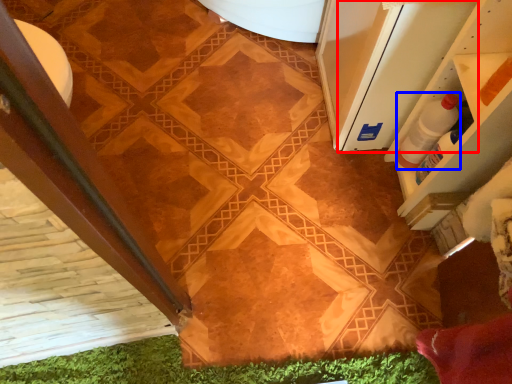
Question: Which object appears closest to the camera in this image, screen door (highlighted by a red box) or bottle (highlighted by a blue box)?

Choices:
 (A) screen door
 (B) bottle

Answer: (A)